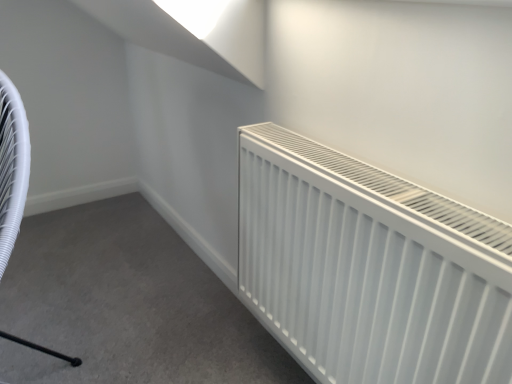
Question: Is white matte radiator at right inside the boundaries of white plastic swivel chair at left, or outside?

Choices:
 (A) inside
 (B) outside

Answer: (B)

Question: Is white matte radiator at right wider or thinner than white plastic swivel chair at left?

Choices:
 (A) wide
 (B) thin

Answer: (B)

Question: Considering the positions of point (421, 276) and point (17, 125), is point (421, 276) closer or farther from the camera than point (17, 125)?

Choices:
 (A) closer
 (B) farther

Answer: (A)

Question: Looking at the image, does white plastic swivel chair at left seem bigger or smaller compared to white matte radiator at right?

Choices:
 (A) small
 (B) big

Answer: (B)

Question: Is white plastic swivel chair at left wider or thinner than white matte radiator at right?

Choices:
 (A) wide
 (B) thin

Answer: (A)

Question: Is white plastic swivel chair at left situated inside white matte radiator at right or outside?

Choices:
 (A) outside
 (B) inside

Answer: (A)

Question: Is white plastic swivel chair at left in front of or behind white matte radiator at right in the image?

Choices:
 (A) front
 (B) behind

Answer: (A)